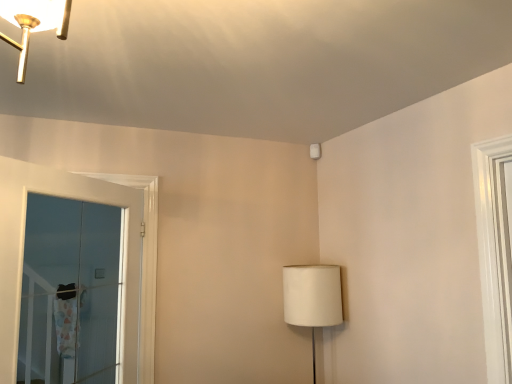
Question: Considering the relative positions of transparent glass door at left and white fabric lampshade at lower right in the image provided, is transparent glass door at left to the right of white fabric lampshade at lower right from the viewer's perspective?

Choices:
 (A) yes
 (B) no

Answer: (B)

Question: Is white fabric lampshade at lower right a part of transparent glass door at left?

Choices:
 (A) yes
 (B) no

Answer: (B)

Question: Is transparent glass door at left turned away from white fabric lampshade at lower right?

Choices:
 (A) no
 (B) yes

Answer: (A)

Question: Is transparent glass door at left facing towards white fabric lampshade at lower right?

Choices:
 (A) yes
 (B) no

Answer: (B)

Question: Is transparent glass door at left located outside white fabric lampshade at lower right?

Choices:
 (A) no
 (B) yes

Answer: (B)

Question: Is transparent glass door at left positioned far away from white fabric lampshade at lower right?

Choices:
 (A) yes
 (B) no

Answer: (A)

Question: Can you confirm if white fabric lampshade at lower right is thinner than transparent glass door at left?

Choices:
 (A) yes
 (B) no

Answer: (B)

Question: Would you say white fabric lampshade at lower right is outside transparent glass door at left?

Choices:
 (A) no
 (B) yes

Answer: (B)

Question: From the image's perspective, is white fabric lampshade at lower right located above transparent glass door at left?

Choices:
 (A) no
 (B) yes

Answer: (A)

Question: Is white fabric lampshade at lower right at the right side of transparent glass door at left?

Choices:
 (A) no
 (B) yes

Answer: (B)

Question: Can you confirm if white fabric lampshade at lower right is bigger than transparent glass door at left?

Choices:
 (A) no
 (B) yes

Answer: (A)

Question: Can transparent glass door at left be found inside white fabric lampshade at lower right?

Choices:
 (A) no
 (B) yes

Answer: (A)

Question: Would you say transparent glass door at left is to the left or to the right of white fabric lampshade at lower right in the picture?

Choices:
 (A) right
 (B) left

Answer: (B)